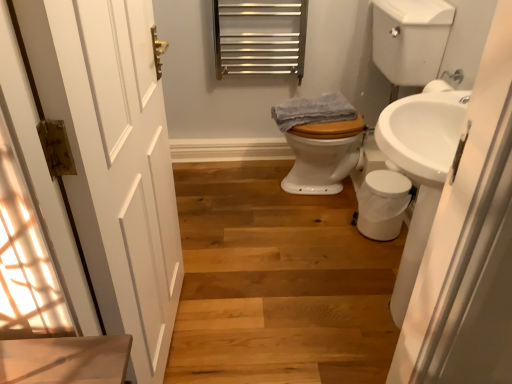
I want to click on vacant space situated above wooden stairs at lower left (from a real-world perspective), so click(x=274, y=252).